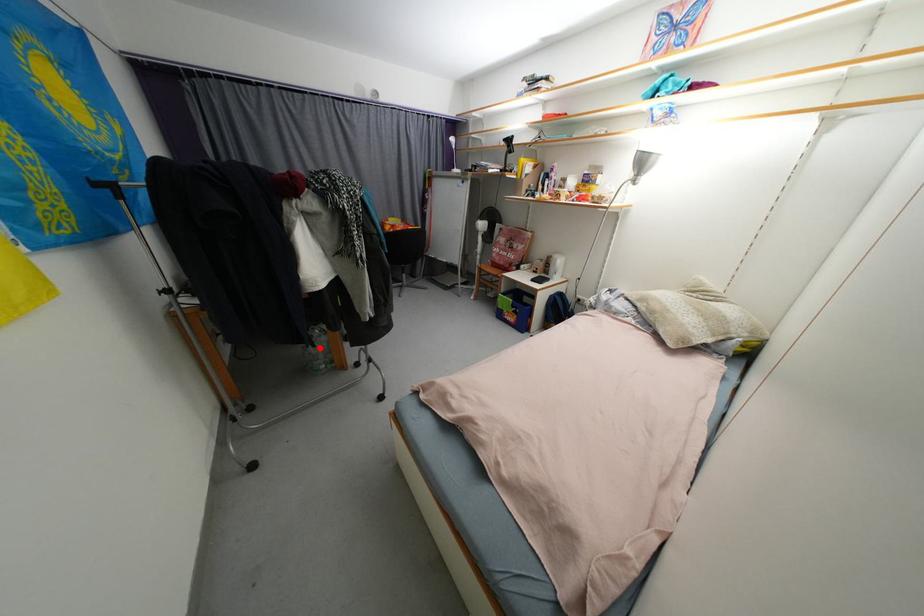
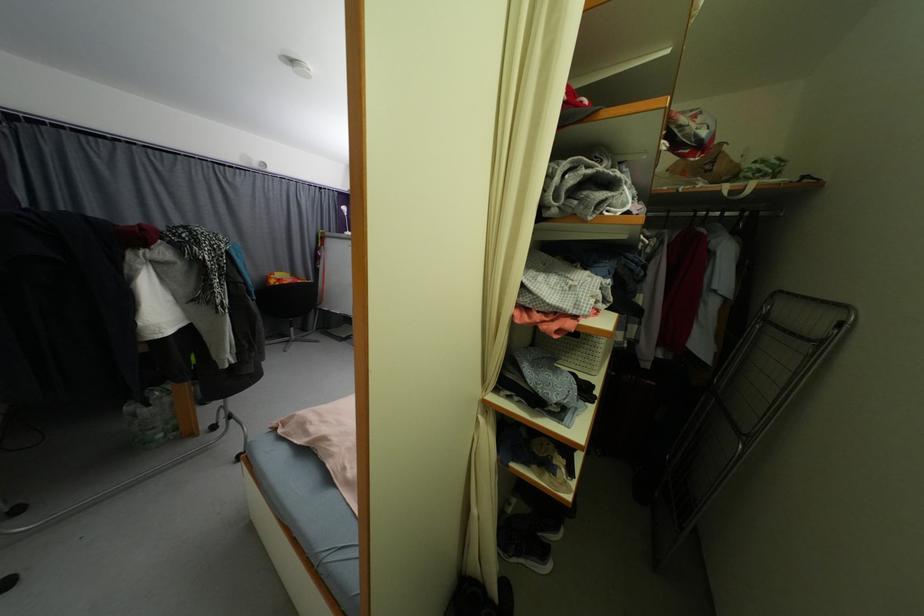
Find the pixel in the second image that matches the highlighted location in the first image.

(154, 407)